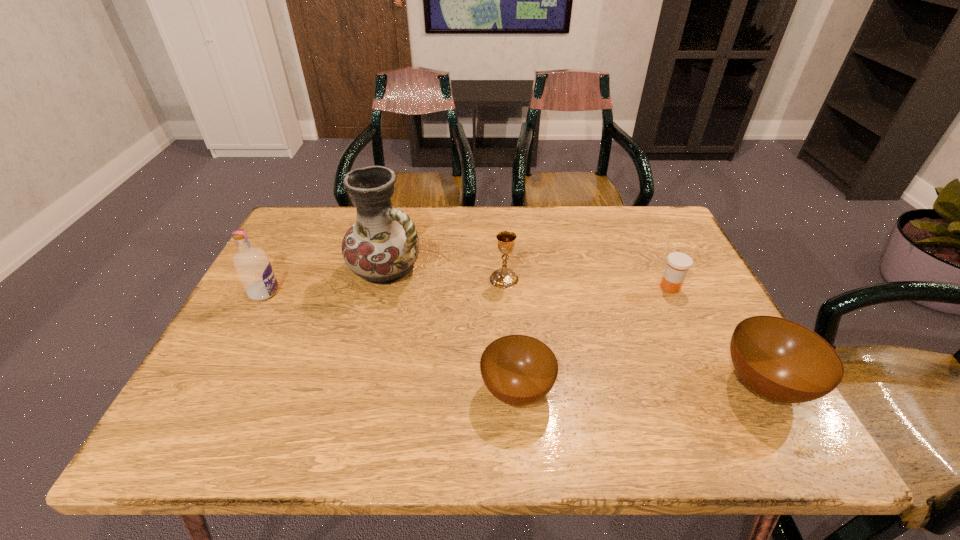
Find the location of a particular element. The width and height of the screenshot is (960, 540). object present at the near right corner is located at coordinates (781, 360).

The width and height of the screenshot is (960, 540). In the image, there is a desktop. In order to click on free region at the far edge in this screenshot , I will do `click(612, 236)`.

The width and height of the screenshot is (960, 540). In the image, there is a desktop. Find the location of `vacant space at the near edge`. vacant space at the near edge is located at coordinates (577, 387).

Locate an element on the screen. The height and width of the screenshot is (540, 960). vacant position at the left edge of the desktop is located at coordinates (278, 265).

Locate an element on the screen. free space at the right edge of the desktop is located at coordinates (653, 264).

Where is `vacant space at the far left corner of the desktop`? Image resolution: width=960 pixels, height=540 pixels. vacant space at the far left corner of the desktop is located at coordinates (320, 212).

Identify the location of vacant space at the near left corner of the desktop. The image size is (960, 540). (204, 395).

In the image, there is a desktop. Where is `free region at the far right corner`? The image size is (960, 540). free region at the far right corner is located at coordinates (658, 220).

Find the location of a particular element. This screenshot has width=960, height=540. free area in between the right bowl and the tallest object is located at coordinates (576, 327).

Locate an element on the screen. Image resolution: width=960 pixels, height=540 pixels. free space that is in between the shorter bowl and the third tallest object is located at coordinates (511, 335).